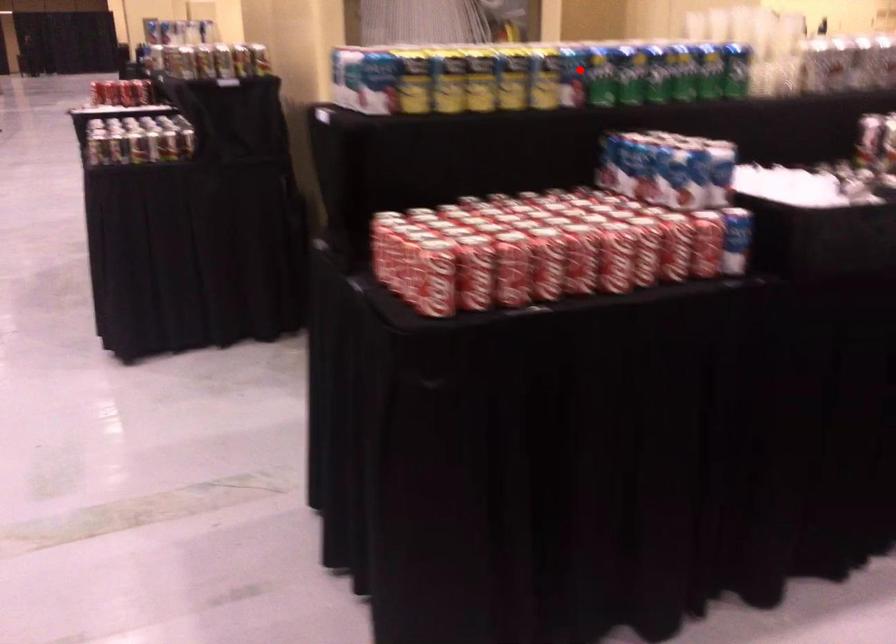
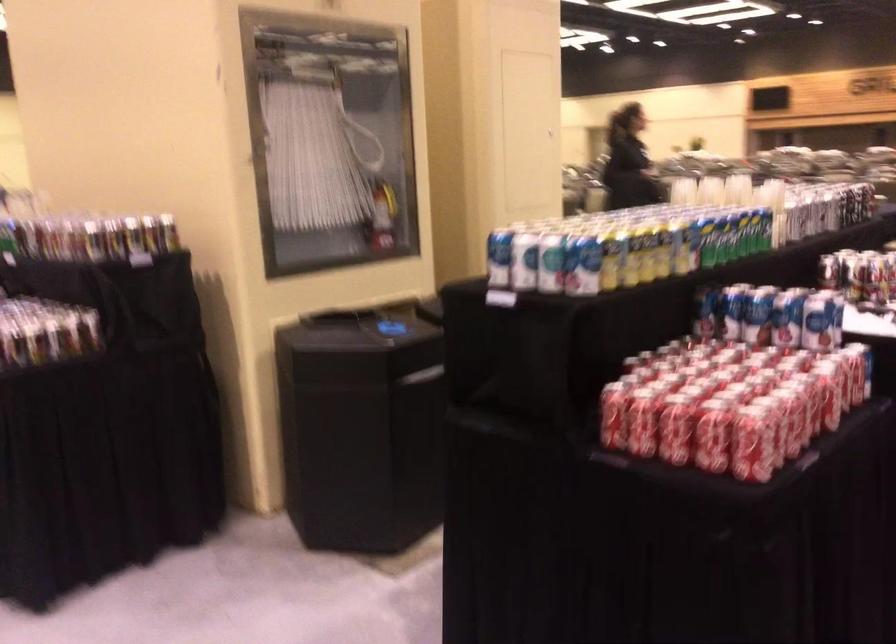
Question: I am providing you with two images of the same scene from different viewpoints. Given a red point in image1, look at the same physical point in image2. Is it:

Choices:
 (A) Closer to the viewpoint
 (B) Farther from the viewpoint

Answer: (B)